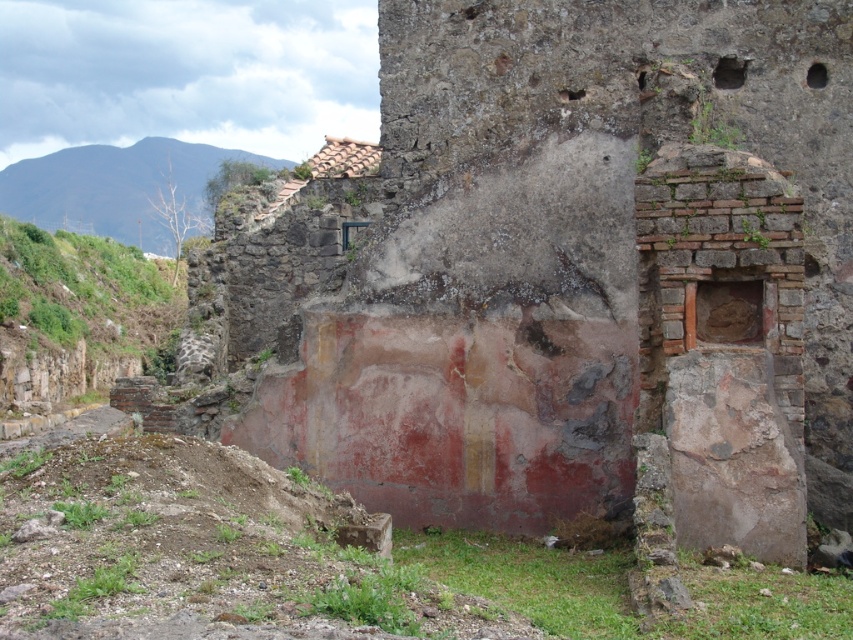
Describe the element at coordinates (566, 272) in the screenshot. I see `reddish-brown stone wall at center` at that location.

Can you confirm if reddish-brown stone wall at center is bigger than green grassy hillside at upper left?

Actually, reddish-brown stone wall at center might be smaller than green grassy hillside at upper left.

Which is behind, point (524, 486) or point (148, 244)?

Positioned behind is point (148, 244).

Identify the location of reddish-brown stone wall at center. Image resolution: width=853 pixels, height=640 pixels. (566, 272).

Which is below, green grassy hillside at left or green grassy hillside at upper left?

green grassy hillside at left is lower down.

Consider the image. Measure the distance between green grassy hillside at left and camera.

45.50 meters

Find the location of a particular element. This screenshot has height=640, width=853. green grassy hillside at left is located at coordinates (76, 320).

Which is more to the right, reddish-brown stone wall at center or green grassy hillside at left?

reddish-brown stone wall at center

How much distance is there between reddish-brown stone wall at center and green grassy hillside at left?

A distance of 98.36 feet exists between reddish-brown stone wall at center and green grassy hillside at left.

Which is behind, point (566, 291) or point (55, 307)?

The point (55, 307) is behind.

Where is `reddish-brown stone wall at center`? reddish-brown stone wall at center is located at coordinates (566, 272).